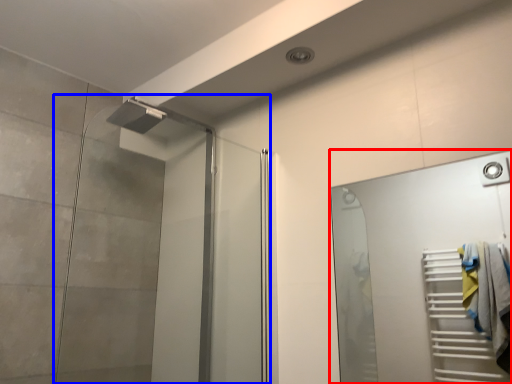
Question: Which object is closer to the camera taking this photo, door (highlighted by a red box) or screen door (highlighted by a blue box)?

Choices:
 (A) door
 (B) screen door

Answer: (A)